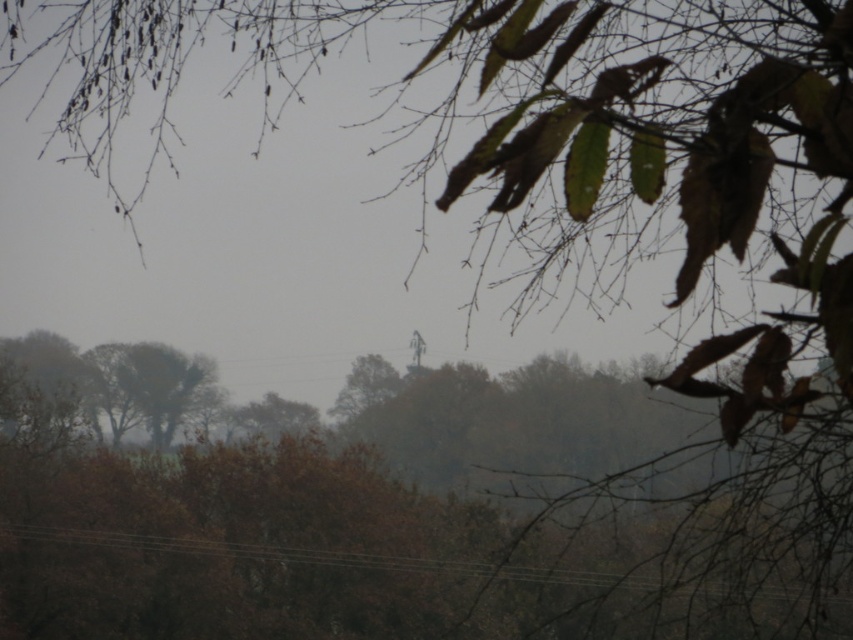
You are a bird flying at an altitude of 20 feet. You spot the brown matte power line at lower center and the brown textured tree at lower left. Can you safely land on either of them without exceeding your altitude limit?

The brown matte power line at lower center is 22.17 feet away from the brown textured tree at lower left. Since the bird is flying at 20 feet, it cannot safely land on the power line because it is higher than the bird can reach. The tree is at lower left, but its height isn not specified. However, since the power line is 22.17 feet away horizontally, the bird can land on the tree if its height is within 20 feet.

You are a drone operator preparing to fly a drone through this landscape. The drone has a minimum flight altitude requirement of 0.4 meters above the ground. Considering the brown matte power line at lower center, what is the vertical clearance between the drone and the power line?

The brown matte power line at lower center is positioned at point (318, 556). Since the drone must maintain a minimum altitude of 0.4 meters above the ground, the vertical clearance between the drone and the power line would be insufficient as 0.375 is below the required altitude. The drone cannot safely fly under the power line in this scenario.

You are a bird flying over the landscape. You want to land on the brown textured tree at lower left. Will the brown matte power line at lower center be in your flight path?

Yes, the brown matte power line at lower center is positioned under the brown textured tree at lower left, so it will be in your flight path.